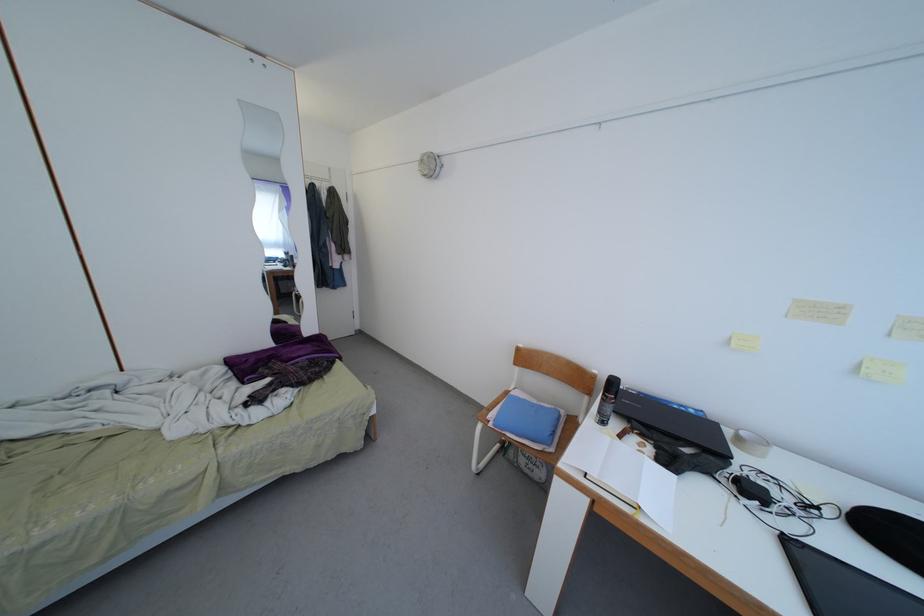
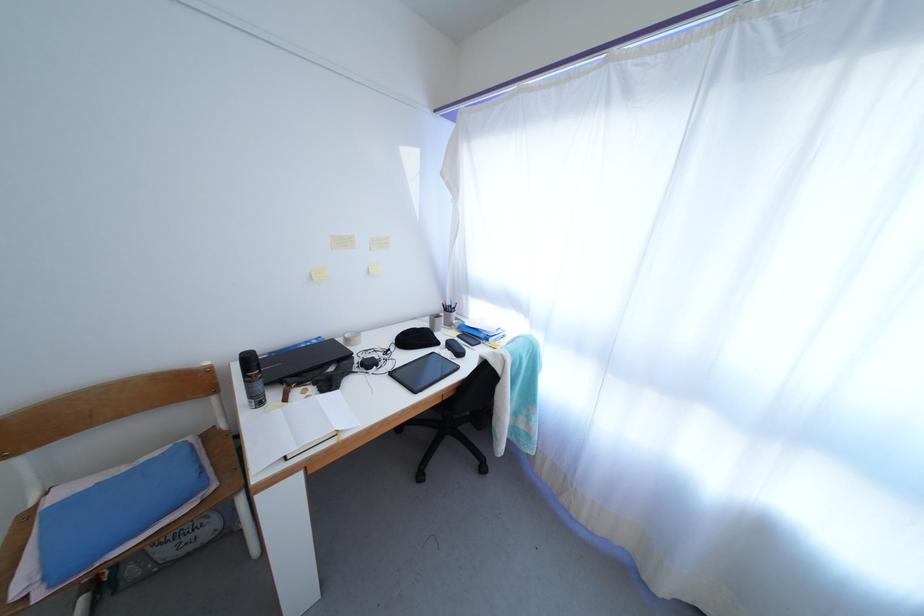
The point at (626, 442) is marked in the first image. Where is the corresponding point in the second image?

(290, 406)